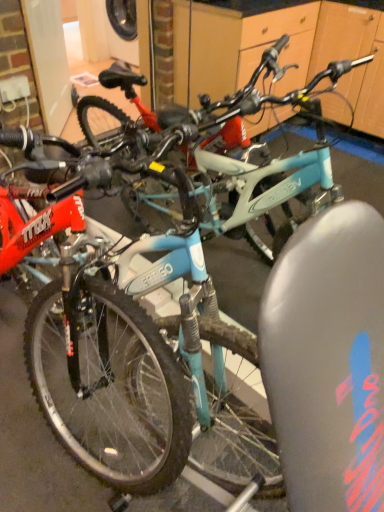
Question: Considering their positions, is matte blue bicycle at center, arranged as the 1th bicycle when ordered from the bottom, located in front of or behind matte blue bicycle at center, the first bicycle in the top-to-bottom sequence?

Choices:
 (A) behind
 (B) front

Answer: (B)

Question: Looking at their shapes, would you say matte blue bicycle at center, the second bicycle in the top-to-bottom sequence, is wider or thinner than matte blue bicycle at center, which ranks as the 2th bicycle in bottom-to-top order?

Choices:
 (A) thin
 (B) wide

Answer: (B)

Question: Is point (99, 243) positioned closer to the camera than point (274, 47)?

Choices:
 (A) farther
 (B) closer

Answer: (B)

Question: Would you say matte blue bicycle at center, the first bicycle in the top-to-bottom sequence, is inside or outside matte blue bicycle at center, arranged as the 1th bicycle when ordered from the bottom?

Choices:
 (A) outside
 (B) inside

Answer: (A)

Question: From the image's perspective, relative to matte blue bicycle at center, arranged as the 1th bicycle when ordered from the bottom, is matte blue bicycle at center, which ranks as the 2th bicycle in bottom-to-top order, above or below?

Choices:
 (A) below
 (B) above

Answer: (B)

Question: Is point (167, 121) positioned closer to the camera than point (104, 248)?

Choices:
 (A) farther
 (B) closer

Answer: (A)

Question: In the image, is matte blue bicycle at center, the first bicycle in the top-to-bottom sequence, on the left side or the right side of matte blue bicycle at center, arranged as the 1th bicycle when ordered from the bottom?

Choices:
 (A) left
 (B) right

Answer: (A)